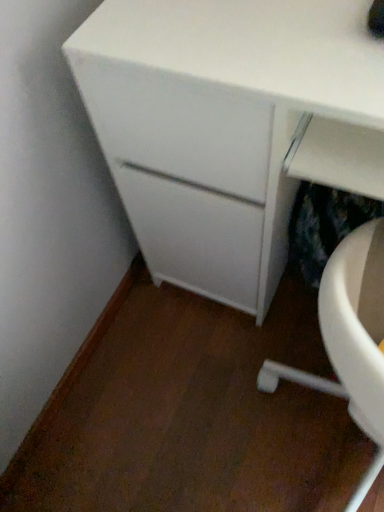
The width and height of the screenshot is (384, 512). What do you see at coordinates (229, 127) in the screenshot?
I see `white matte cabinet at upper left` at bounding box center [229, 127].

Identify the location of white matte cabinet at upper left. The image size is (384, 512). (229, 127).

Locate an element on the screen. The width and height of the screenshot is (384, 512). white matte cabinet at upper left is located at coordinates (229, 127).